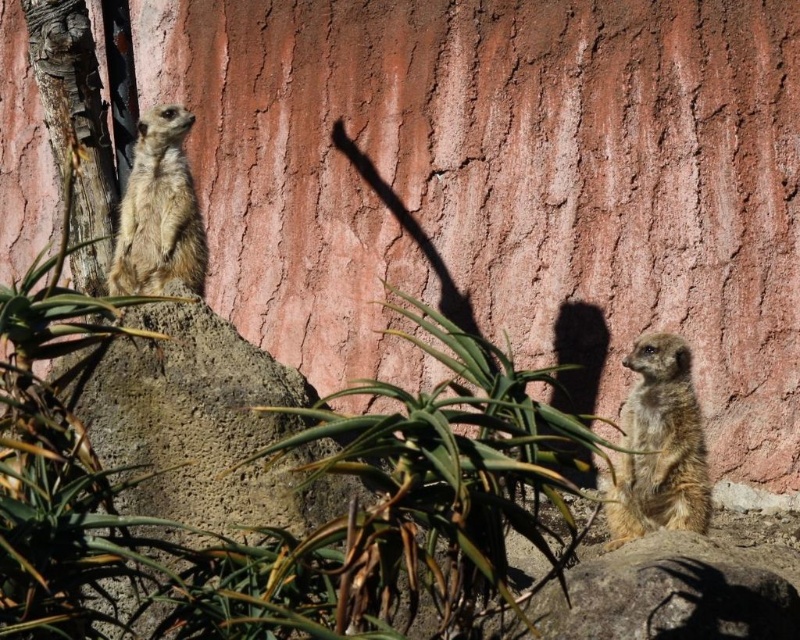
Question: From the image, what is the correct spatial relationship of fuzzy brown meerkat at lower right in relation to golden fur meerkat at upper left?

Choices:
 (A) right
 (B) left

Answer: (A)

Question: Which point is farther to the camera?

Choices:
 (A) golden fur meerkat at upper left
 (B) green leafy plant at center
 (C) fuzzy brown meerkat at lower right

Answer: (A)

Question: Which is farther from the golden fur meerkat at upper left?

Choices:
 (A) fuzzy brown meerkat at lower right
 (B) green leafy plant at center

Answer: (B)

Question: Is green leafy plant at center wider than golden fur meerkat at upper left?

Choices:
 (A) yes
 (B) no

Answer: (A)

Question: Can you confirm if fuzzy brown meerkat at lower right is positioned to the left of golden fur meerkat at upper left?

Choices:
 (A) yes
 (B) no

Answer: (B)

Question: Among these objects, which one is farthest from the camera?

Choices:
 (A) green leafy plant at center
 (B) golden fur meerkat at upper left
 (C) fuzzy brown meerkat at lower right

Answer: (B)